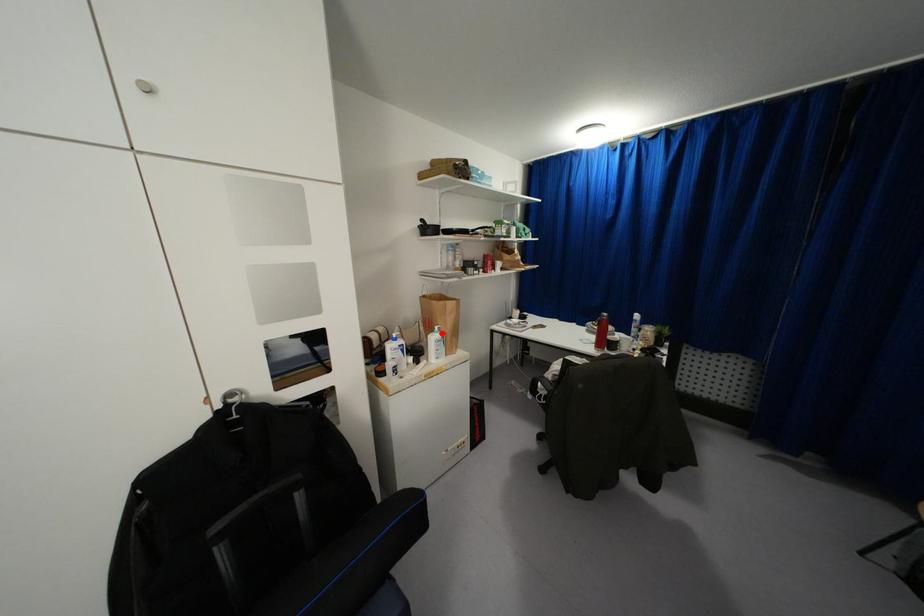
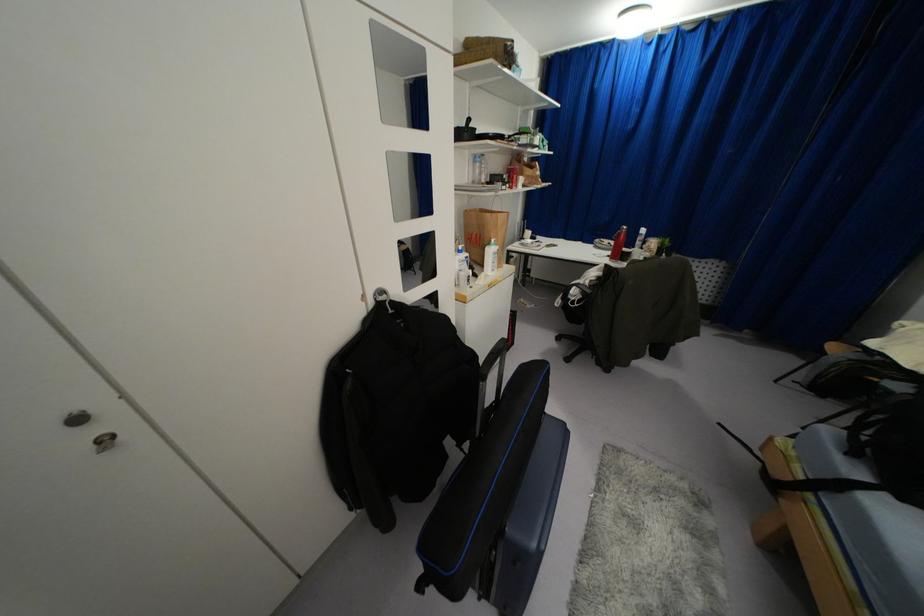
Question: I am providing you with two images of the same scene from different viewpoints. Image1 has a red point marked. In image2, the corresponding 3D location appears at what relative position? Reply with the corresponding letter.

Choices:
 (A) Closer
 (B) Farther

Answer: (A)